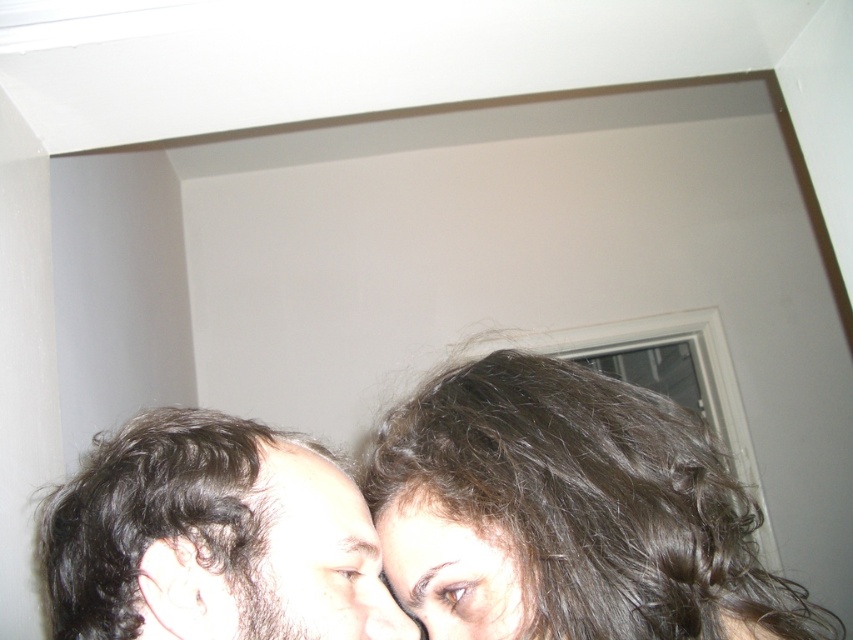
Question: Which point appears farthest from the camera in this image?

Choices:
 (A) (480, 609)
 (B) (393, 618)

Answer: (B)

Question: Which object is closer to the camera taking this photo?

Choices:
 (A) dark curly hair at lower left
 (B) dark brown hair at center

Answer: (B)

Question: Does dark curly hair at center have a lesser width compared to pale skin at center?

Choices:
 (A) no
 (B) yes

Answer: (A)

Question: Is dark brown hair at center further to the viewer compared to brown curly hair at center?

Choices:
 (A) no
 (B) yes

Answer: (A)

Question: Based on their relative distances, which object is nearer to the pale skin at center?

Choices:
 (A) dark brown hair at center
 (B) brown curly hair at center
 (C) dark curly hair at center

Answer: (B)

Question: Is dark brown hair at center positioned in front of dark curly hair at lower left?

Choices:
 (A) no
 (B) yes

Answer: (B)